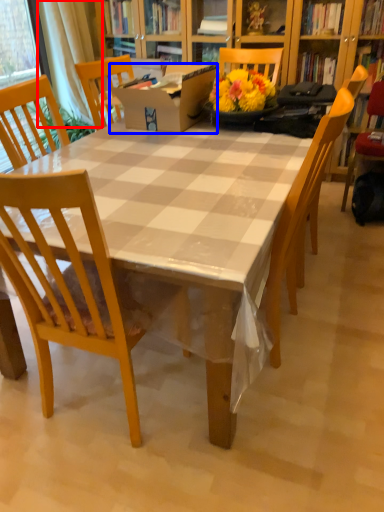
Question: Which point is further to the camera, curtain (highlighted by a red box) or box (highlighted by a blue box)?

Choices:
 (A) curtain
 (B) box

Answer: (A)